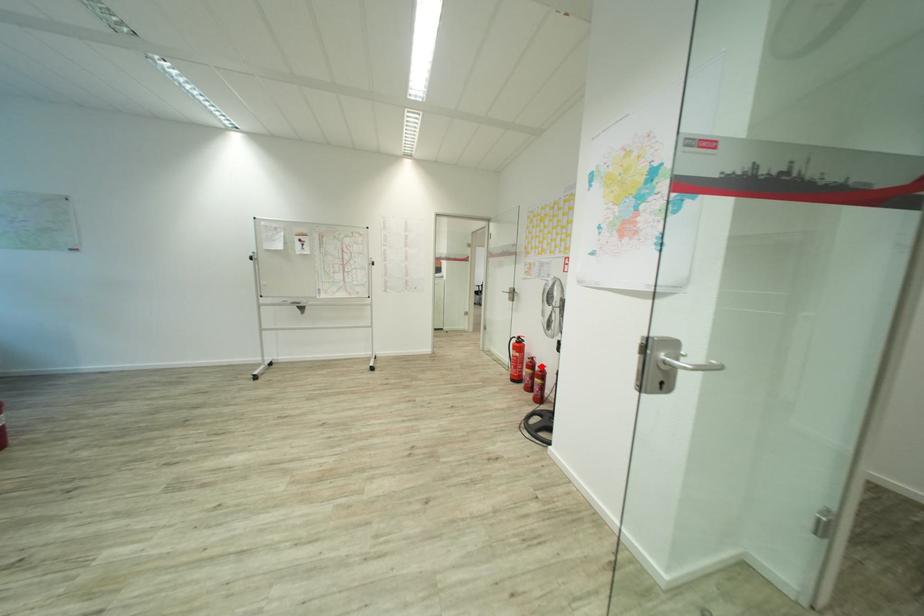
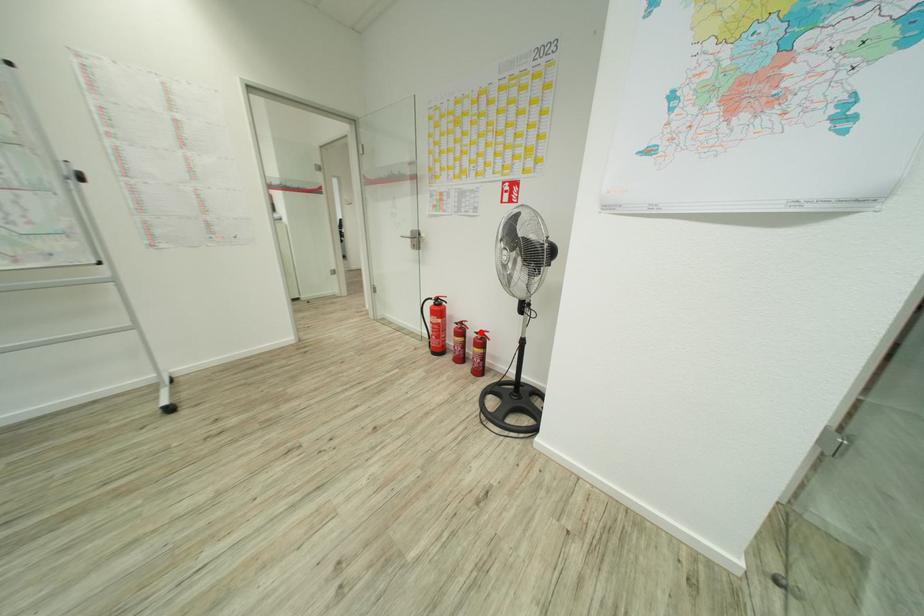
I am providing you with two images of the same scene from different viewpoints. A red point is marked on the first image and another point is marked on the second image. Do the highlighted points in image1 and image2 indicate the same real-world spot?

Yes